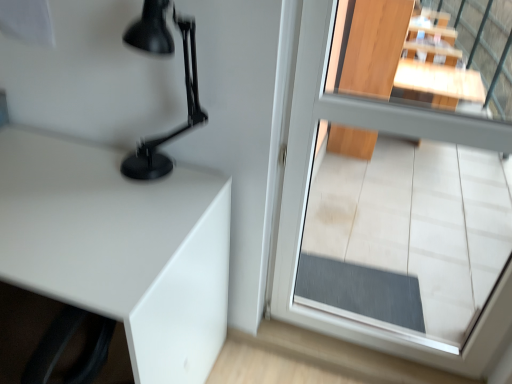
The width and height of the screenshot is (512, 384). What are the coordinates of `free space to the left of matte black lamp at upper left` in the screenshot? It's located at (87, 179).